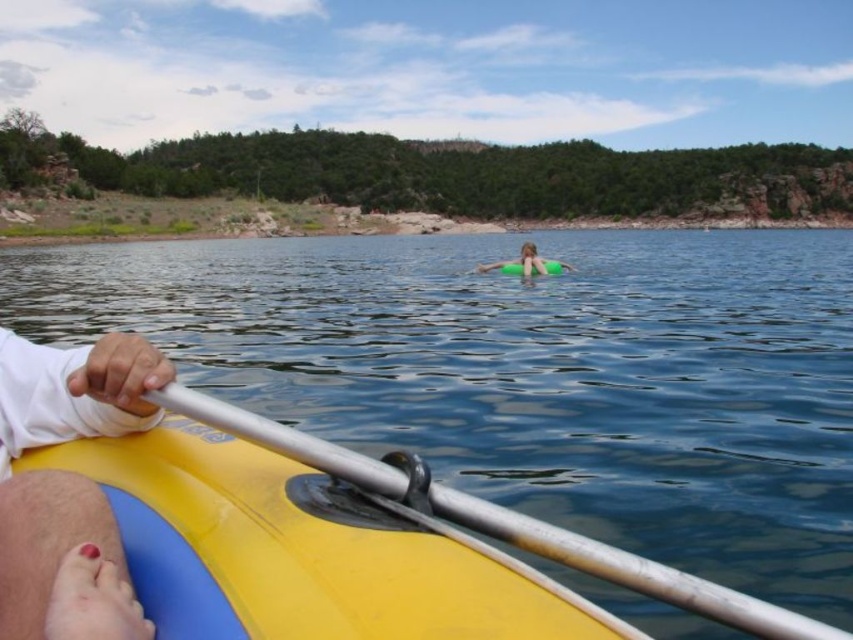
Is point (502, 509) positioned after point (537, 260)?

No, it is in front of (537, 260).

Identify the location of silver metallic paddle at lower left. (630, 570).

The width and height of the screenshot is (853, 640). I want to click on silver metallic paddle at lower left, so click(630, 570).

Which is above, white matte paddle at lower left or green rubber ring at center?

green rubber ring at center

Measure the distance between white matte paddle at lower left and camera.

white matte paddle at lower left is 5.84 meters from camera.

Locate an element on the screen. This screenshot has width=853, height=640. white matte paddle at lower left is located at coordinates (59, 470).

Does white matte paddle at lower left appear on the left side of silver metallic paddle at lower left?

Correct, you'll find white matte paddle at lower left to the left of silver metallic paddle at lower left.

Looking at this image, how far apart are white matte paddle at lower left and silver metallic paddle at lower left?

white matte paddle at lower left and silver metallic paddle at lower left are 7.70 feet apart from each other.

Find the location of a particular element. The height and width of the screenshot is (640, 853). white matte paddle at lower left is located at coordinates (59, 470).